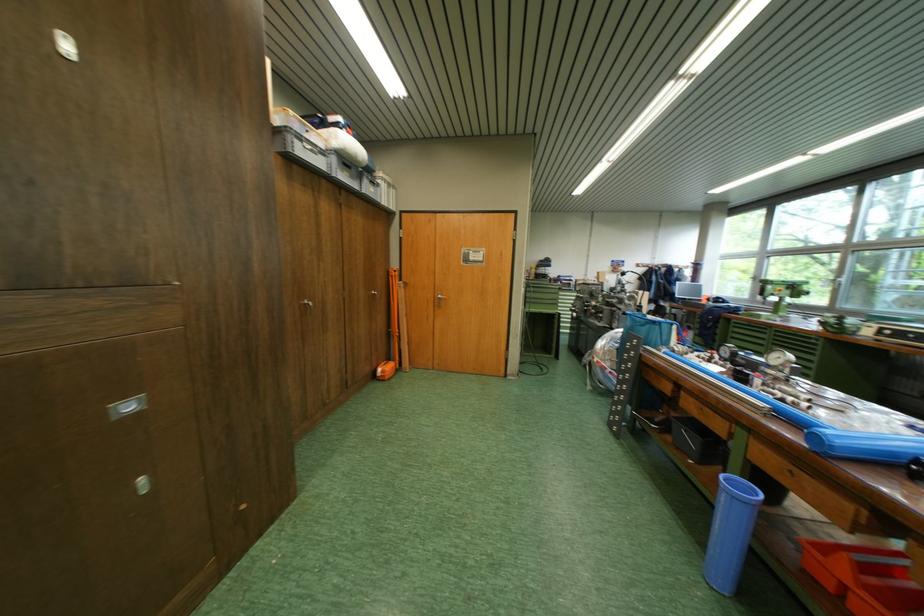
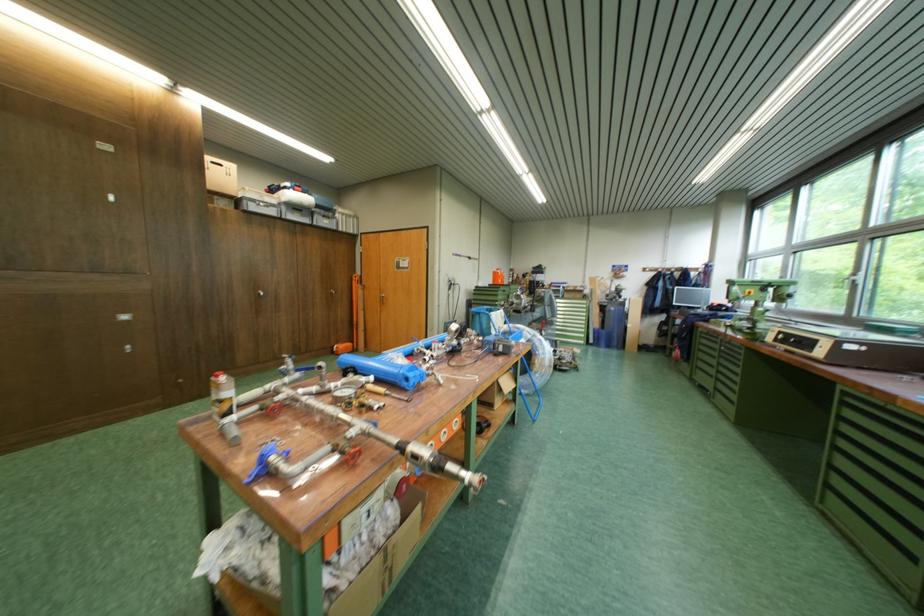
In the second image, find the point that corresponds to point 412,294 in the first image.

(371, 294)